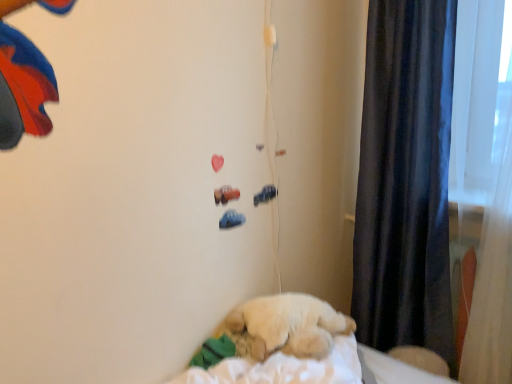
Question: From the image's perspective, is white soft sheet at lower right located above or below dark blue velvet curtain at right?

Choices:
 (A) below
 (B) above

Answer: (A)

Question: Relative to dark blue velvet curtain at right, is white soft sheet at lower right in front or behind?

Choices:
 (A) behind
 (B) front

Answer: (A)

Question: Considering the real-world distances, which object is closest to the fluffy beige dog at center?

Choices:
 (A) white plush at center
 (B) dark blue velvet curtain at right
 (C) white soft sheet at lower right

Answer: (A)

Question: Based on their relative distances, which object is farther from the white plush at center?

Choices:
 (A) fluffy beige dog at center
 (B) white soft sheet at lower right
 (C) dark blue velvet curtain at right

Answer: (C)